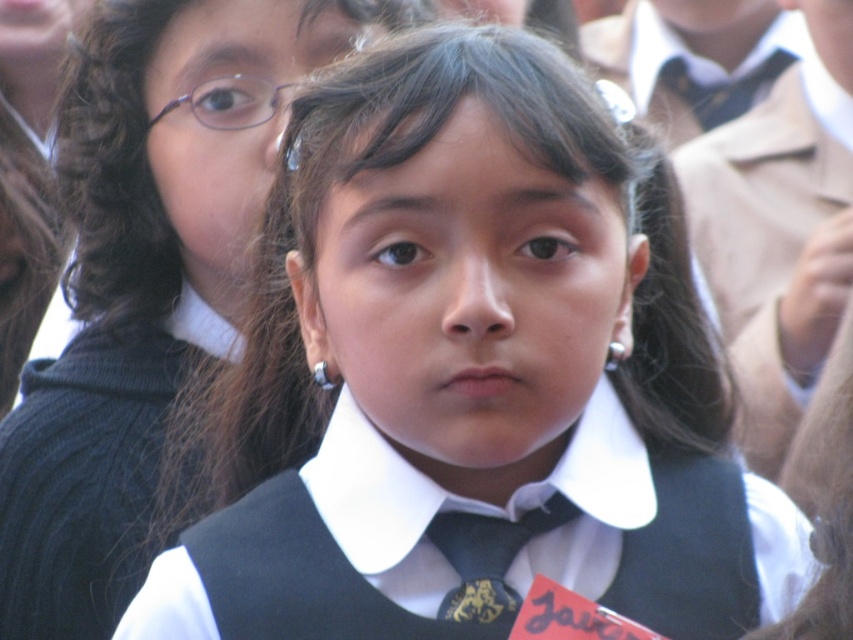
Can you confirm if matte black tie at upper right is smaller than purple plastic glasses at upper left?

Actually, matte black tie at upper right might be larger than purple plastic glasses at upper left.

Can you confirm if matte black tie at upper right is taller than purple plastic glasses at upper left?

Yes.

Between point (743, 106) and point (265, 108), which one is positioned in front?

Positioned in front is point (265, 108).

At what (x,y) coordinates should I click in order to perform the action: click on matte black tie at upper right. Please return your answer as a coordinate pair (x, y). The width and height of the screenshot is (853, 640). Looking at the image, I should click on (709, 93).

Looking at this image, is dark blue textured tie at center thinner than purple plastic glasses at upper left?

Yes.

Does dark blue textured tie at center have a lesser height compared to purple plastic glasses at upper left?

Incorrect, dark blue textured tie at center's height does not fall short of purple plastic glasses at upper left's.

Between point (555, 499) and point (195, 104), which one is positioned behind?

Positioned behind is point (195, 104).

The width and height of the screenshot is (853, 640). In order to click on dark blue textured tie at center in this screenshot , I will do `click(488, 556)`.

Does dark blue textured tie at center have a greater width compared to matte black tie at upper right?

No.

Based on the photo, which is more to the right, dark blue textured tie at center or matte black tie at upper right?

From the viewer's perspective, matte black tie at upper right appears more on the right side.

The image size is (853, 640). Describe the element at coordinates (488, 556) in the screenshot. I see `dark blue textured tie at center` at that location.

Image resolution: width=853 pixels, height=640 pixels. I want to click on dark blue textured tie at center, so click(x=488, y=556).